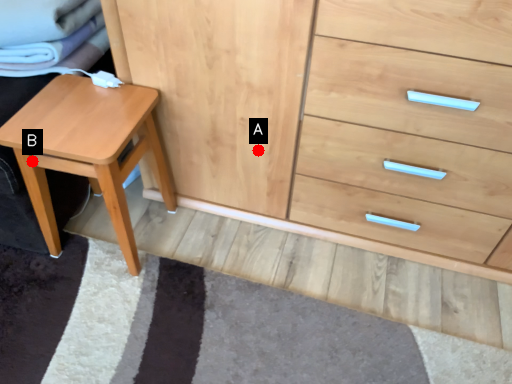
Question: Two points are circled on the image, labeled by A and B beside each circle. Which point is closer to the camera?

Choices:
 (A) A is closer
 (B) B is closer

Answer: (B)